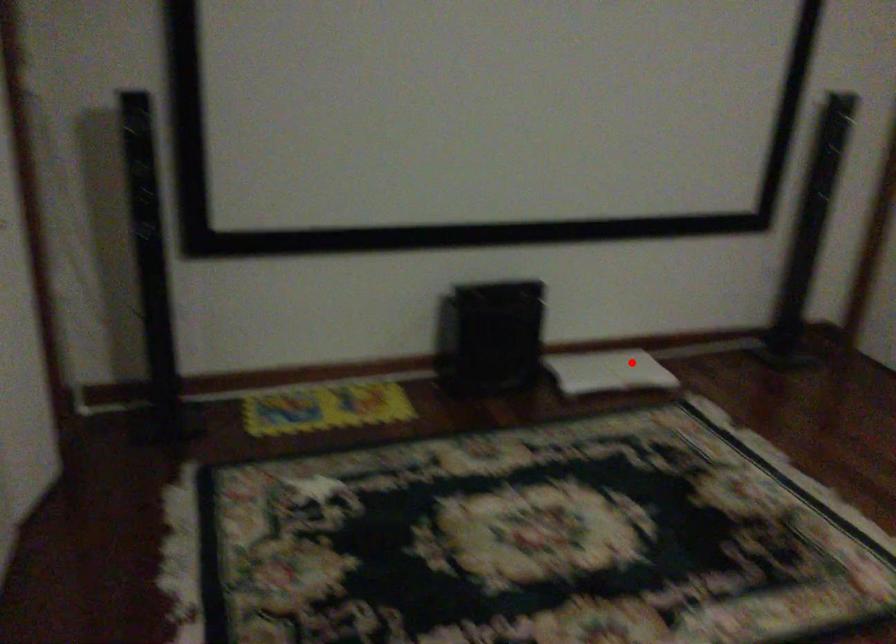
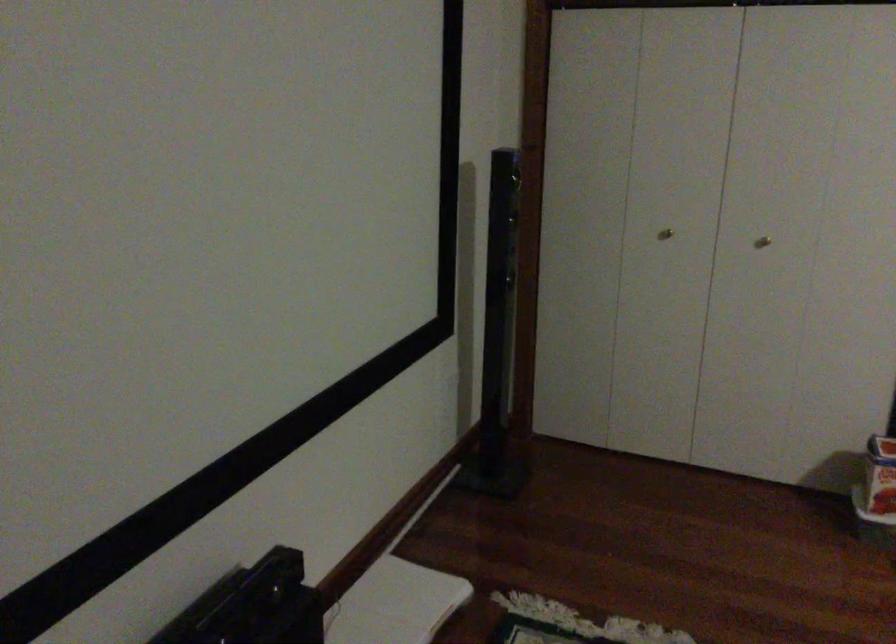
Find the pixel in the second image that matches the highlighted location in the first image.

(394, 603)